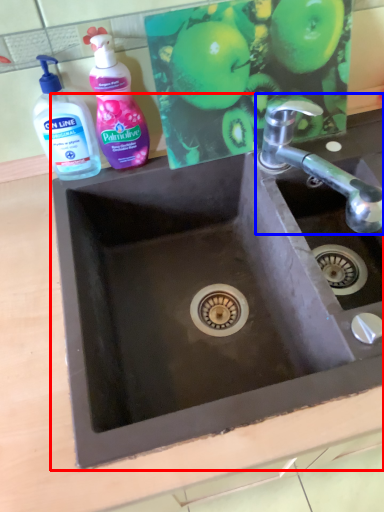
Question: Which object appears closest to the camera in this image, sink (highlighted by a red box) or tap (highlighted by a blue box)?

Choices:
 (A) sink
 (B) tap

Answer: (A)